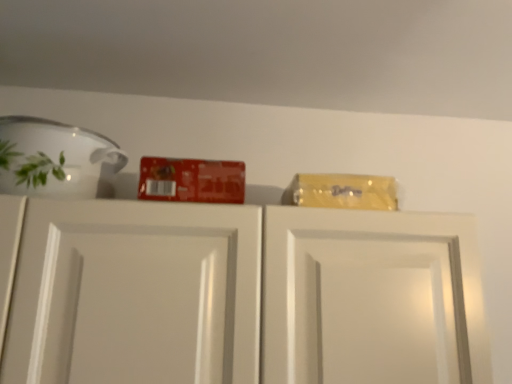
Question: Is white glossy cabinet doors at upper center behind white glossy bowl at upper left?

Choices:
 (A) yes
 (B) no

Answer: (B)

Question: Is white glossy cabinet doors at upper center to the left of white glossy bowl at upper left from the viewer's perspective?

Choices:
 (A) no
 (B) yes

Answer: (A)

Question: From the image's perspective, does white glossy cabinet doors at upper center appear higher than white glossy bowl at upper left?

Choices:
 (A) no
 (B) yes

Answer: (A)

Question: Is white glossy cabinet doors at upper center looking in the opposite direction of white glossy bowl at upper left?

Choices:
 (A) no
 (B) yes

Answer: (A)

Question: Is white glossy cabinet doors at upper center outside of white glossy bowl at upper left?

Choices:
 (A) yes
 (B) no

Answer: (A)

Question: Could you tell me if white glossy cabinet doors at upper center is facing white glossy bowl at upper left?

Choices:
 (A) no
 (B) yes

Answer: (A)

Question: Is white glossy bowl at upper left at the left side of white glossy cabinet doors at upper center?

Choices:
 (A) no
 (B) yes

Answer: (B)

Question: Is the surface of white glossy bowl at upper left in direct contact with white glossy cabinet doors at upper center?

Choices:
 (A) yes
 (B) no

Answer: (B)

Question: Considering the relative sizes of white glossy bowl at upper left and white glossy cabinet doors at upper center in the image provided, is white glossy bowl at upper left thinner than white glossy cabinet doors at upper center?

Choices:
 (A) no
 (B) yes

Answer: (B)

Question: Is white glossy bowl at upper left not inside white glossy cabinet doors at upper center?

Choices:
 (A) no
 (B) yes

Answer: (B)

Question: Does white glossy bowl at upper left have a smaller size compared to white glossy cabinet doors at upper center?

Choices:
 (A) no
 (B) yes

Answer: (B)

Question: Considering the relative sizes of white glossy bowl at upper left and white glossy cabinet doors at upper center in the image provided, is white glossy bowl at upper left wider than white glossy cabinet doors at upper center?

Choices:
 (A) no
 (B) yes

Answer: (A)

Question: From a real-world perspective, is white glossy cabinet doors at upper center physically located above or below white glossy bowl at upper left?

Choices:
 (A) below
 (B) above

Answer: (A)